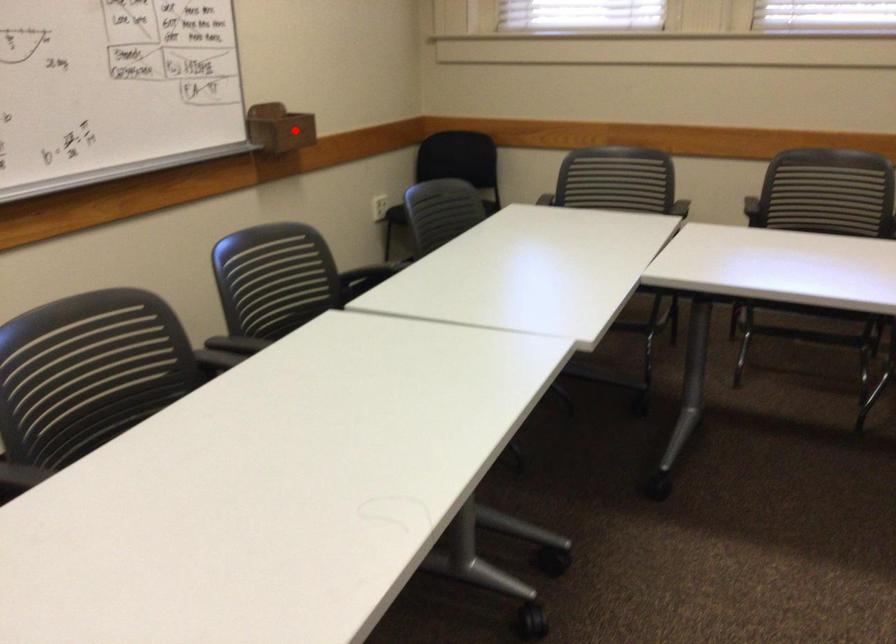
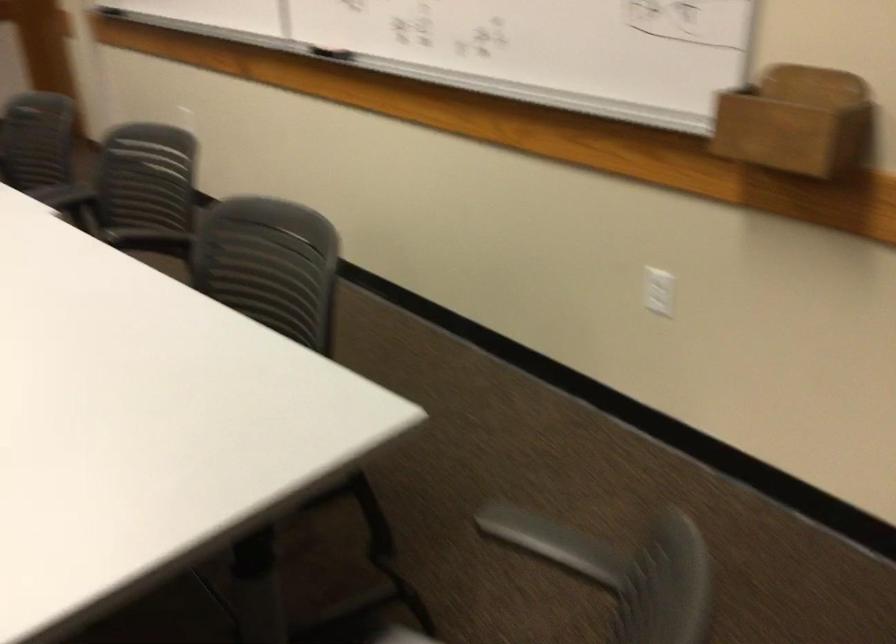
Question: I am providing you with two images of the same scene from different viewpoints. A red point is shown in image1. For the corresponding object point in image2, is it positioned nearer or farther from the camera?

Choices:
 (A) Nearer
 (B) Farther

Answer: (A)